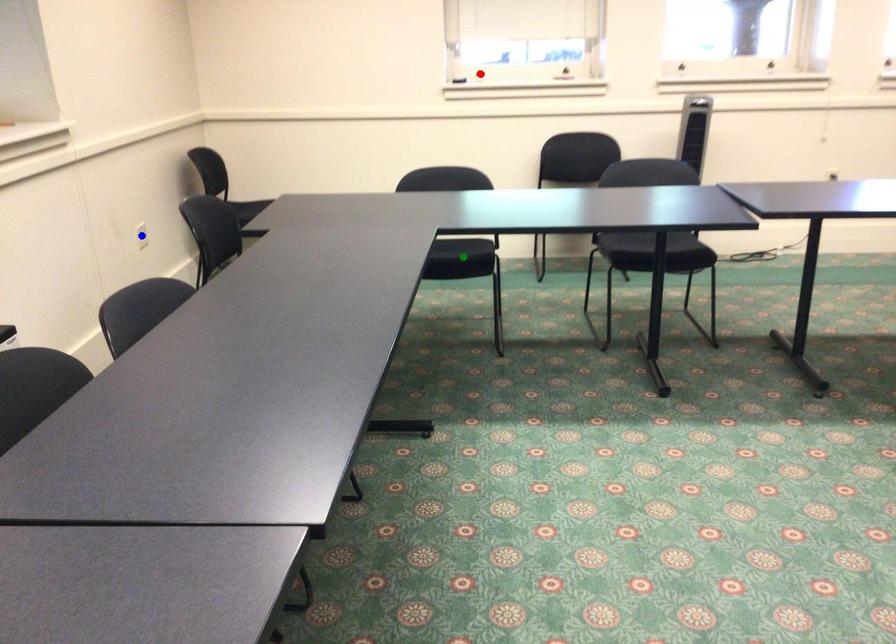
From the picture: Order these from farthest to nearest:
green point
blue point
red point

red point → blue point → green point